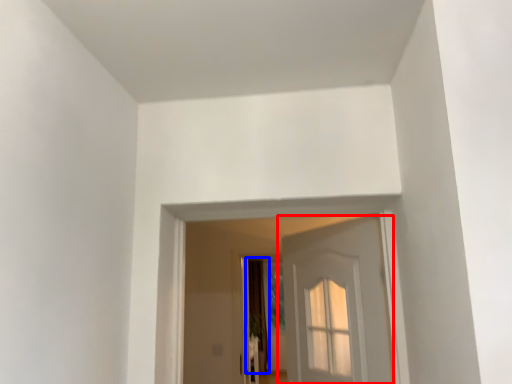
Question: Which of the following is the farthest to the observer, door (highlighted by a red box) or curtain (highlighted by a blue box)?

Choices:
 (A) door
 (B) curtain

Answer: (B)